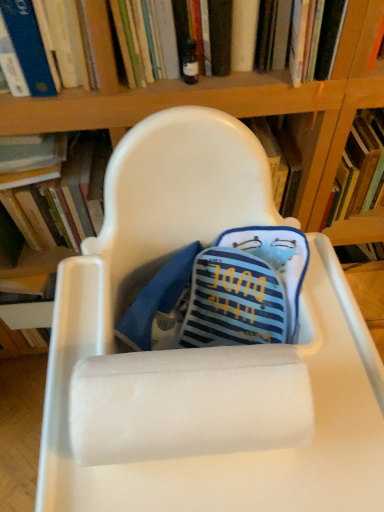
Question: Does blue hardcover book at upper left, arranged as the 2th book when viewed from the left, have a lesser height compared to hardcover book at upper center, the 1th book viewed from the right?

Choices:
 (A) yes
 (B) no

Answer: (B)

Question: From a real-world perspective, is blue hardcover book at upper left, arranged as the 2th book when viewed from the left, below hardcover book at upper center, the 3th book in the left-to-right sequence?

Choices:
 (A) no
 (B) yes

Answer: (A)

Question: Can you confirm if blue hardcover book at upper left, arranged as the 2th book when viewed from the left, is thinner than hardcover book at upper center, the 3th book in the left-to-right sequence?

Choices:
 (A) no
 (B) yes

Answer: (B)

Question: Considering the relative sizes of blue hardcover book at upper left, the 2th book viewed from the right, and hardcover book at upper center, the 3th book in the left-to-right sequence, in the image provided, is blue hardcover book at upper left, the 2th book viewed from the right, wider than hardcover book at upper center, the 3th book in the left-to-right sequence,?

Choices:
 (A) yes
 (B) no

Answer: (B)

Question: Is blue hardcover book at upper left, arranged as the 2th book when viewed from the left, at the right side of hardcover book at upper center, the 3th book in the left-to-right sequence?

Choices:
 (A) no
 (B) yes

Answer: (A)

Question: Is hardcover book at left, which is the third book from right to left, to the left or to the right of blue hardcover book at upper left, the 2th book viewed from the right, in the image?

Choices:
 (A) right
 (B) left

Answer: (B)

Question: Is hardcover book at left, the first book from the left, wider or thinner than blue hardcover book at upper left, arranged as the 2th book when viewed from the left?

Choices:
 (A) wide
 (B) thin

Answer: (A)

Question: Does point (62, 180) appear closer or farther from the camera than point (79, 50)?

Choices:
 (A) farther
 (B) closer

Answer: (A)

Question: In the image, is hardcover book at left, the first book from the left, positioned in front of or behind blue hardcover book at upper left, arranged as the 2th book when viewed from the left?

Choices:
 (A) front
 (B) behind

Answer: (B)

Question: Based on their sizes in the image, would you say hardcover book at left, the first book from the left, is bigger or smaller than white plastic chair at center?

Choices:
 (A) small
 (B) big

Answer: (A)

Question: From their relative heights in the image, would you say hardcover book at left, which is the third book from right to left, is taller or shorter than white plastic chair at center?

Choices:
 (A) tall
 (B) short

Answer: (B)

Question: In the image, is hardcover book at left, the first book from the left, positioned in front of or behind white plastic chair at center?

Choices:
 (A) behind
 (B) front

Answer: (A)

Question: Is hardcover book at left, the first book from the left, to the left or to the right of white plastic chair at center in the image?

Choices:
 (A) left
 (B) right

Answer: (A)

Question: Considering the positions of hardcover book at upper center, the 1th book viewed from the right, and hardcover book at left, the first book from the left, in the image, is hardcover book at upper center, the 1th book viewed from the right, bigger or smaller than hardcover book at left, the first book from the left,?

Choices:
 (A) small
 (B) big

Answer: (A)

Question: In the image, is hardcover book at upper center, the 3th book in the left-to-right sequence, on the left side or the right side of hardcover book at left, which is the third book from right to left?

Choices:
 (A) right
 (B) left

Answer: (A)